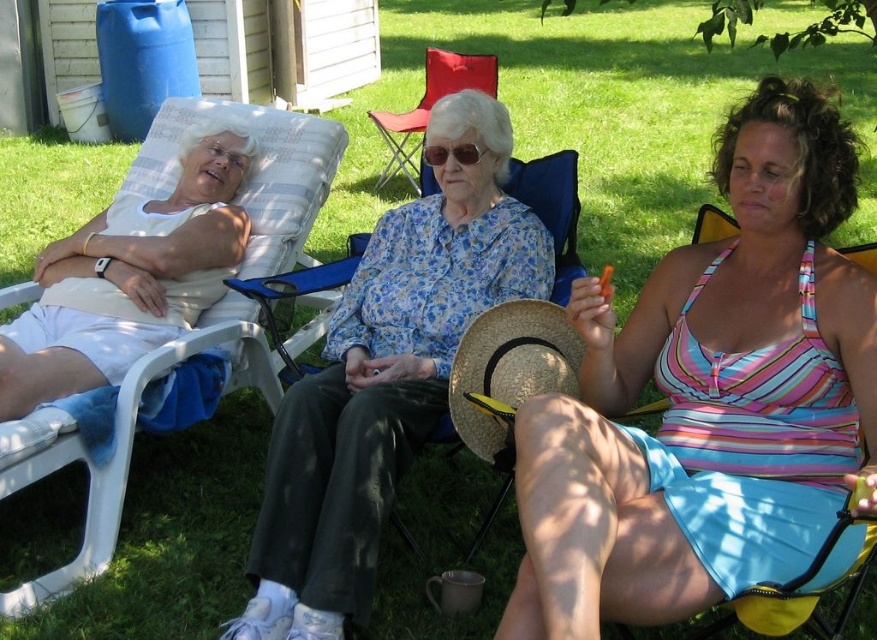
Question: Among these objects, which one is nearest to the camera?

Choices:
 (A) strawtexturehat at center
 (B) white matte tank top at left
 (C) red fabric folding chair at center

Answer: (A)

Question: Which object is farther from the camera taking this photo?

Choices:
 (A) striped fabric tank top at center
 (B) strawtexturehat at center
 (C) floral fabric blouse at center
 (D) white matte tank top at left

Answer: (D)

Question: Can you confirm if striped fabric tank top at center is positioned below floral fabric blouse at center?

Choices:
 (A) no
 (B) yes

Answer: (B)

Question: Can you confirm if striped fabric tank top at center is wider than white plastic beach chair at left?

Choices:
 (A) no
 (B) yes

Answer: (A)

Question: Is floral fabric blouse at center wider than white plastic beach chair at left?

Choices:
 (A) yes
 (B) no

Answer: (A)

Question: Which point is closer to the camera?

Choices:
 (A) strawtexturehat at center
 (B) red fabric folding chair at center
 (C) floral fabric blouse at center

Answer: (A)